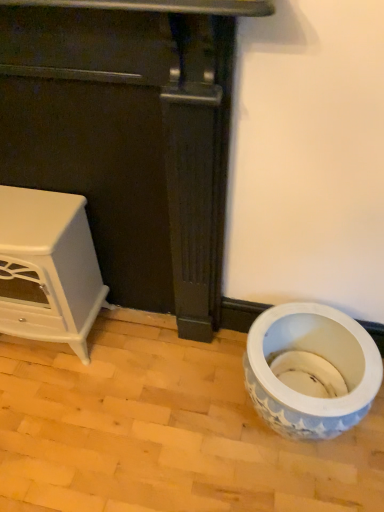
Question: Considering the relative sizes of white glossy stove at left, which ranks as the 2th furniture in left-to-right order, and blue and white ceramic vase at lower right in the image provided, is white glossy stove at left, which ranks as the 2th furniture in left-to-right order, taller than blue and white ceramic vase at lower right?

Choices:
 (A) no
 (B) yes

Answer: (B)

Question: Is white glossy stove at left, the first furniture viewed from the right, behind blue and white ceramic vase at lower right?

Choices:
 (A) yes
 (B) no

Answer: (B)

Question: Is white glossy stove at left, the first furniture viewed from the right, to the left of blue and white ceramic vase at lower right from the viewer's perspective?

Choices:
 (A) yes
 (B) no

Answer: (A)

Question: Does white glossy stove at left, which ranks as the 2th furniture in left-to-right order, turn towards blue and white ceramic vase at lower right?

Choices:
 (A) no
 (B) yes

Answer: (A)

Question: Is white glossy stove at left, the first furniture viewed from the right, to the right of blue and white ceramic vase at lower right from the viewer's perspective?

Choices:
 (A) yes
 (B) no

Answer: (B)

Question: Considering their positions, is blue and white ceramic vase at lower right located in front of or behind white glossy stove at left, the first furniture viewed from the right?

Choices:
 (A) front
 (B) behind

Answer: (B)

Question: In terms of width, does blue and white ceramic vase at lower right look wider or thinner when compared to white glossy stove at left, the first furniture viewed from the right?

Choices:
 (A) thin
 (B) wide

Answer: (B)

Question: From a real-world perspective, is blue and white ceramic vase at lower right above or below white glossy stove at left, which ranks as the 2th furniture in left-to-right order?

Choices:
 (A) below
 (B) above

Answer: (A)

Question: In terms of size, does blue and white ceramic vase at lower right appear bigger or smaller than white glossy stove at left, the first furniture viewed from the right?

Choices:
 (A) big
 (B) small

Answer: (B)

Question: Would you say white glossy stove at left, the first furniture viewed from the right, is to the left or to the right of white glossy cabinet at left, which is the first furniture in left-to-right order, in the picture?

Choices:
 (A) left
 (B) right

Answer: (B)

Question: Looking at their shapes, would you say white glossy stove at left, which ranks as the 2th furniture in left-to-right order, is wider or thinner than white glossy cabinet at left, which is the first furniture in left-to-right order?

Choices:
 (A) wide
 (B) thin

Answer: (B)

Question: Is white glossy stove at left, which ranks as the 2th furniture in left-to-right order, in front of or behind white glossy cabinet at left, which is the first furniture in left-to-right order, in the image?

Choices:
 (A) front
 (B) behind

Answer: (A)

Question: From the image's perspective, relative to white glossy cabinet at left, the 2th furniture when ordered from right to left, is white glossy stove at left, which ranks as the 2th furniture in left-to-right order, above or below?

Choices:
 (A) below
 (B) above

Answer: (B)

Question: Is white glossy stove at left, the first furniture viewed from the right, to the left or to the right of blue and white ceramic vase at lower right in the image?

Choices:
 (A) left
 (B) right

Answer: (A)

Question: Considering the positions of white glossy stove at left, which ranks as the 2th furniture in left-to-right order, and blue and white ceramic vase at lower right in the image, is white glossy stove at left, which ranks as the 2th furniture in left-to-right order, taller or shorter than blue and white ceramic vase at lower right?

Choices:
 (A) short
 (B) tall

Answer: (B)